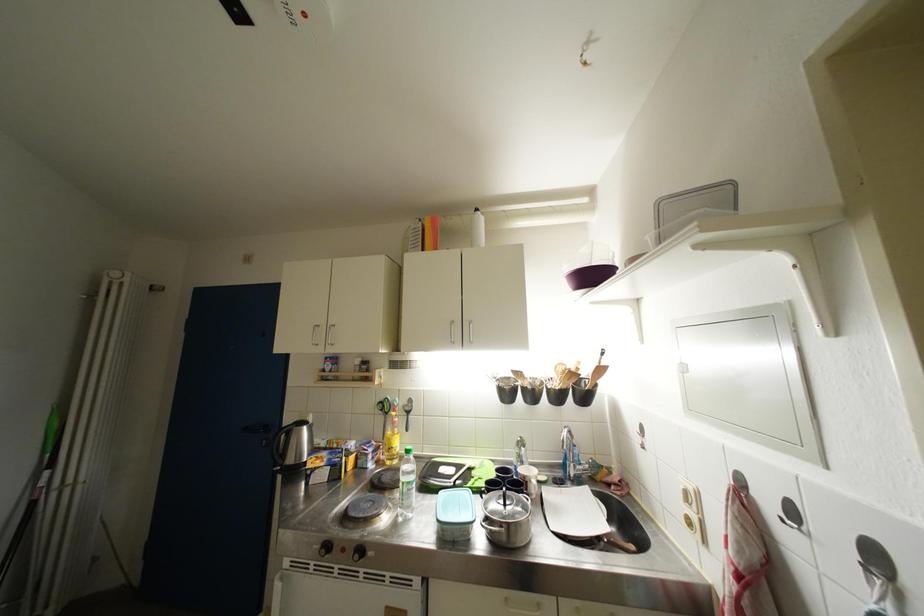
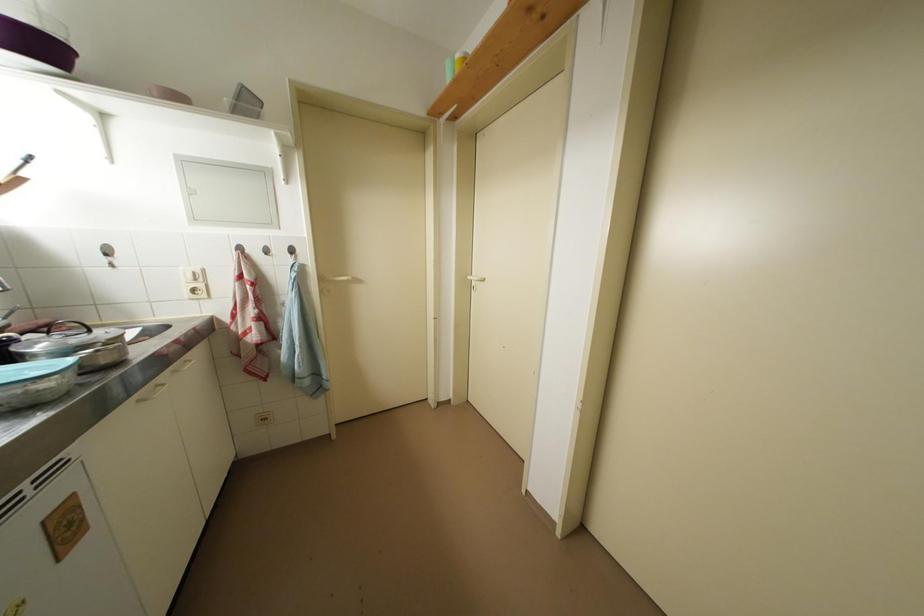
The point at (693, 496) is marked in the first image. Where is the corresponding point in the second image?

(201, 277)